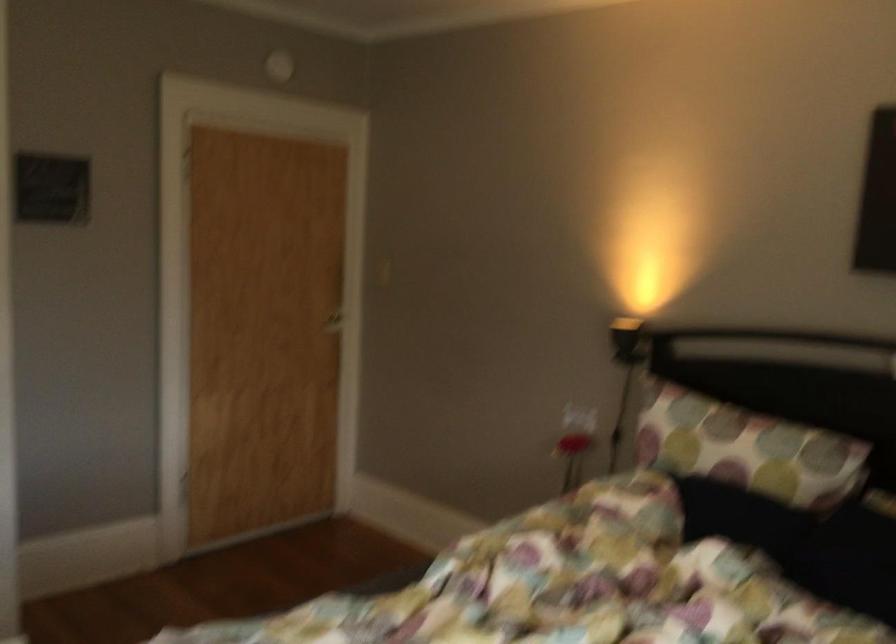
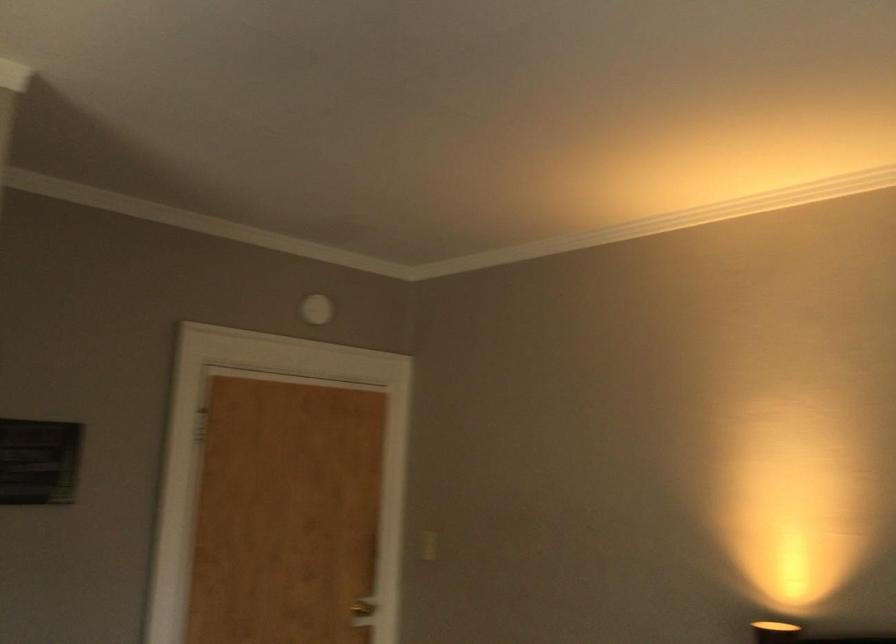
Where in the second image is the point corresponding to [385,269] from the first image?

(427, 545)